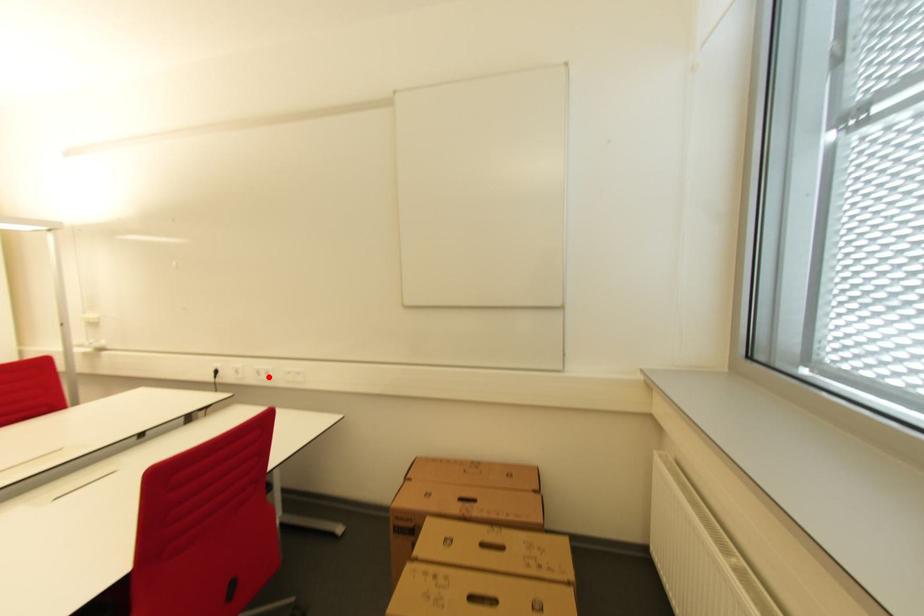
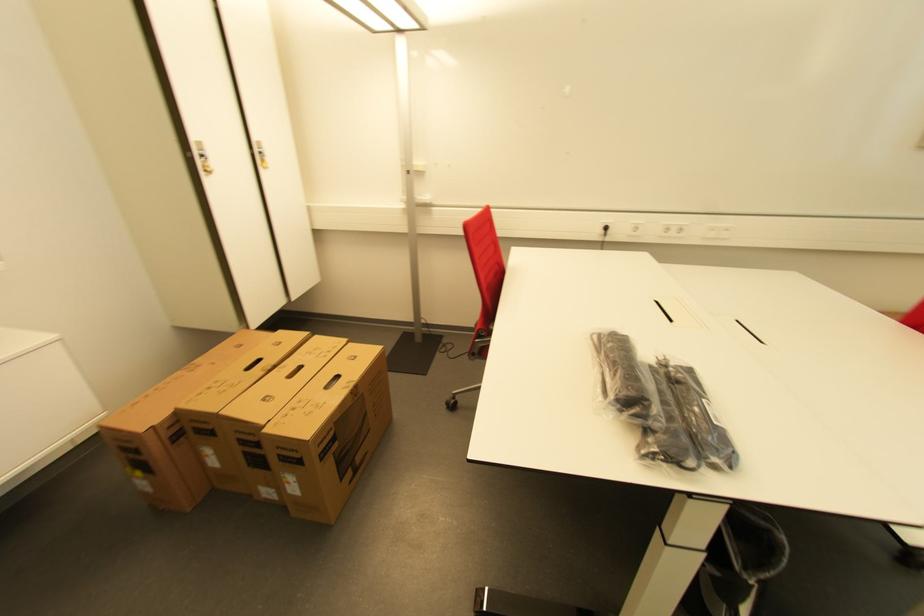
Question: I am providing you with two images of the same scene from different viewpoints. Image1 has a red point marked. In image2, the corresponding 3D location appears at what relative position? Reply with the corresponding letter.

Choices:
 (A) Closer
 (B) Farther

Answer: (A)